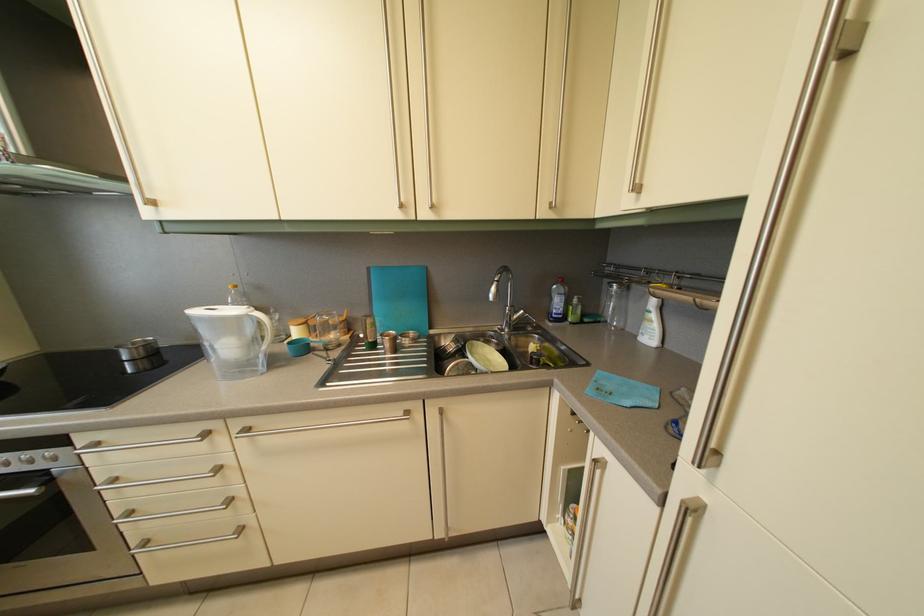
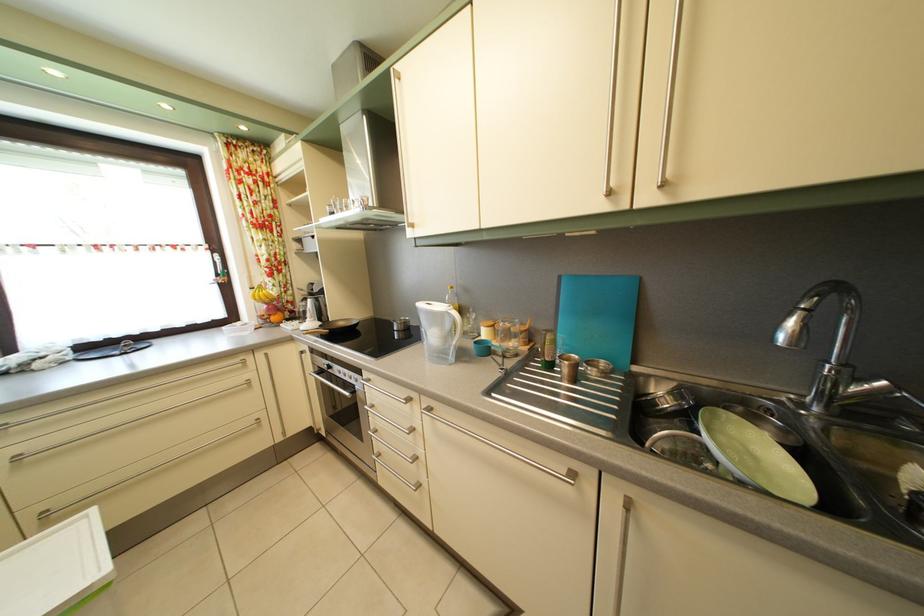
Where in the second image is the point corresponding to [497,369] from the first image?

(763, 466)